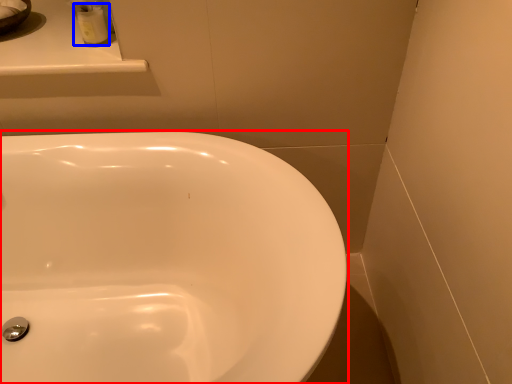
Question: Which of the following is the closest to the observer, sink (highlighted by a red box) or toiletry (highlighted by a blue box)?

Choices:
 (A) sink
 (B) toiletry

Answer: (A)